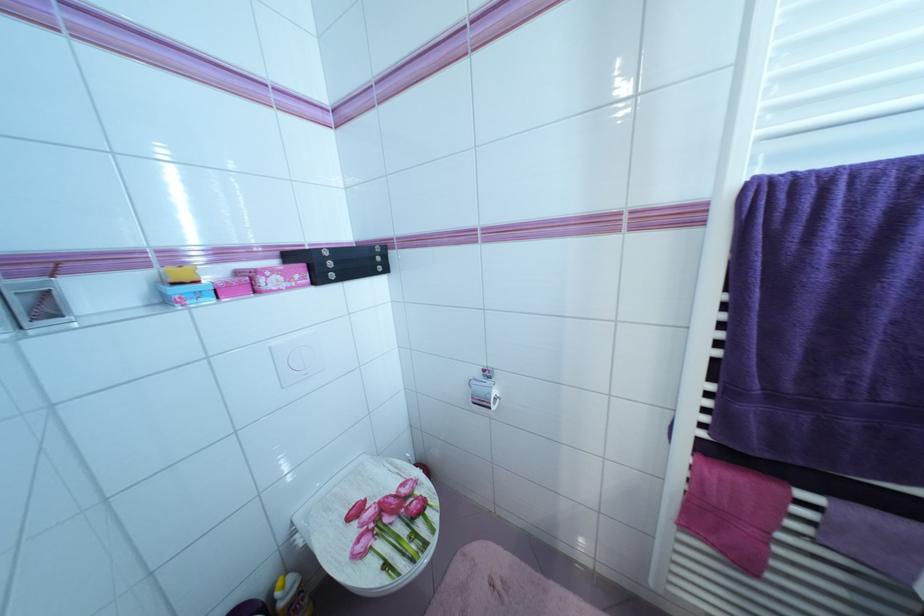
Where is `yellow cleaning bottle`? This screenshot has width=924, height=616. yellow cleaning bottle is located at coordinates (292, 596).